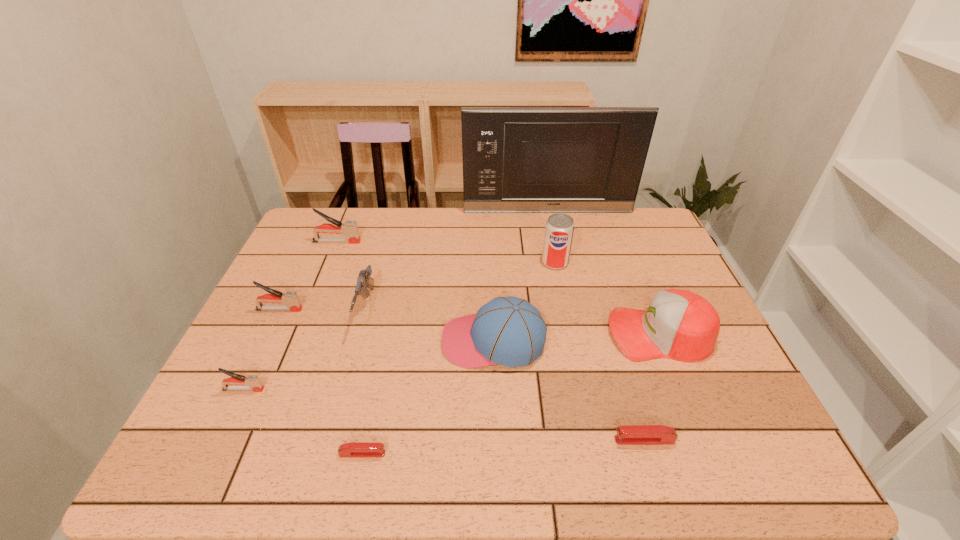
Identify the location of free space located on the front-facing side of the fourth farthest stapler. (488, 440).

Where is `free space located on the front-facing side of the fourth farthest stapler`? The width and height of the screenshot is (960, 540). free space located on the front-facing side of the fourth farthest stapler is located at coordinates (513, 440).

The image size is (960, 540). Find the location of `free space located on the front-facing side of the fifth object from left to right`. free space located on the front-facing side of the fifth object from left to right is located at coordinates (455, 454).

Identify the location of microwave oven present at the far edge. Image resolution: width=960 pixels, height=540 pixels. (515, 159).

In order to click on stapler that is at the far edge in this screenshot , I will do `click(349, 228)`.

I want to click on microwave oven located in the right edge section of the desktop, so click(515, 159).

Identify the location of baseball cap located at the right edge. The image size is (960, 540). (681, 325).

This screenshot has height=540, width=960. I want to click on object at the far left corner, so click(349, 228).

The width and height of the screenshot is (960, 540). Find the location of `object located at the far right corner`. object located at the far right corner is located at coordinates (515, 159).

Identify the location of vacant space at the far edge of the desktop. This screenshot has height=540, width=960. (504, 217).